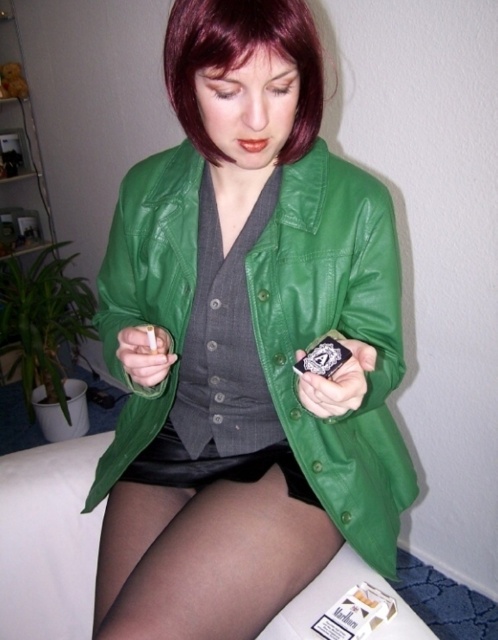
Can you confirm if green leather jacket at center is shorter than dark red silky hair at upper center?

No, green leather jacket at center is not shorter than dark red silky hair at upper center.

Describe the element at coordinates (245, 342) in the screenshot. I see `green leather jacket at center` at that location.

Where is `green leather jacket at center`? The image size is (498, 640). green leather jacket at center is located at coordinates (245, 342).

Looking at this image, between black sheer tights at lower center and dark red silky hair at upper center, which one is positioned lower?

black sheer tights at lower center is lower down.

Who is more forward, (160, 576) or (226, 20)?

Point (226, 20)

Find the location of a particular element. The image size is (498, 640). black sheer tights at lower center is located at coordinates (205, 557).

Find the location of a particular element. The image size is (498, 640). black sheer tights at lower center is located at coordinates (205, 557).

Is green leather jacket at center smaller than black sheer tights at lower center?

Incorrect, green leather jacket at center is not smaller in size than black sheer tights at lower center.

Is point (202, 326) positioned before point (271, 484)?

Yes.

Identify the location of green leather jacket at center. (245, 342).